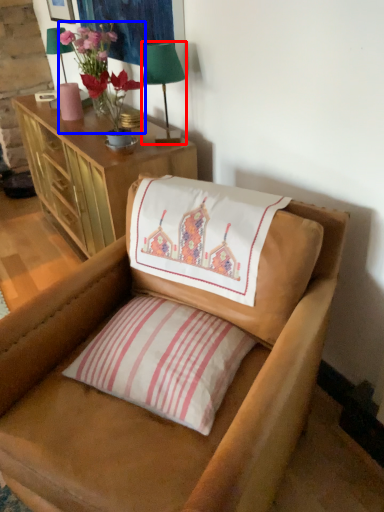
Question: Which of the following is the closest to the observer, table lamp (highlighted by a red box) or floral arrangement (highlighted by a blue box)?

Choices:
 (A) table lamp
 (B) floral arrangement

Answer: (A)